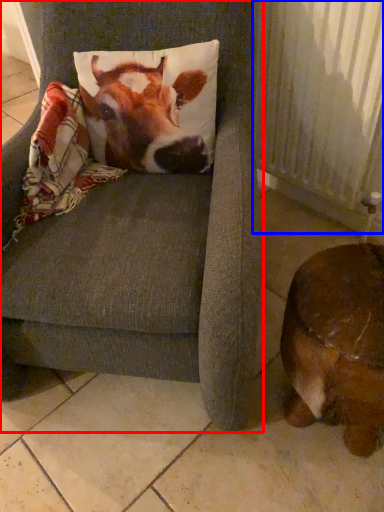
Question: Which object is closer to the camera taking this photo, chair (highlighted by a red box) or radiator (highlighted by a blue box)?

Choices:
 (A) chair
 (B) radiator

Answer: (A)